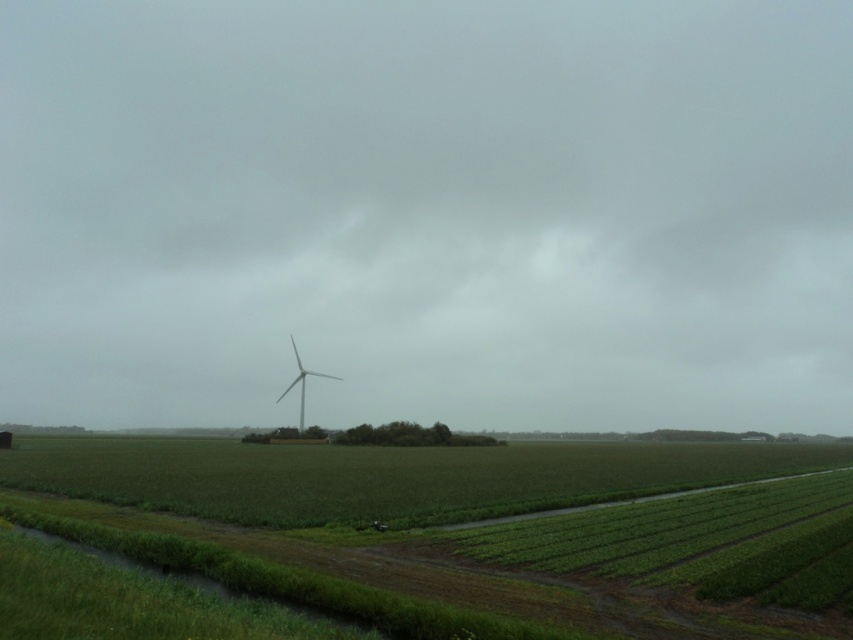
Between green grassy field at center and white matte windmill at center, which one is positioned higher?

green grassy field at center is above.

Which is below, green grassy field at center or white matte windmill at center?

white matte windmill at center

Find the location of a particular element. Image resolution: width=853 pixels, height=640 pixels. green grassy field at center is located at coordinates (428, 518).

Find the location of a particular element. The width and height of the screenshot is (853, 640). green grassy field at center is located at coordinates (428, 518).

Does matte white wind turbine at center come in front of white matte windmill at center?

No.

Which is more to the left, matte white wind turbine at center or white matte windmill at center?

Positioned to the left is white matte windmill at center.

At what (x,y) coordinates should I click in order to perform the action: click on matte white wind turbine at center. Please return your answer as a coordinate pair (x, y). Looking at the image, I should click on (427, 212).

Who is more forward, (442, 156) or (677, 465)?

Positioned in front is point (677, 465).

Between matte white wind turbine at center and green grassy field at center, which one is positioned lower?

green grassy field at center is lower down.

What do you see at coordinates (427, 212) in the screenshot? I see `matte white wind turbine at center` at bounding box center [427, 212].

This screenshot has height=640, width=853. In order to click on matte white wind turbine at center in this screenshot , I will do `click(427, 212)`.